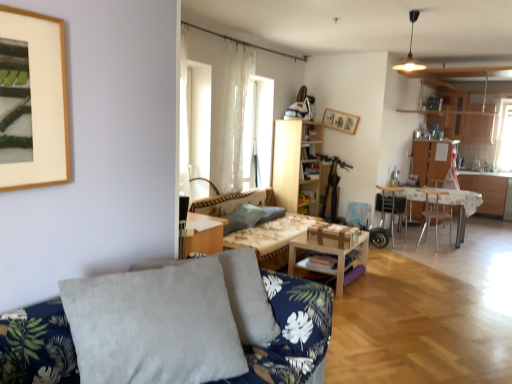
Question: From the image's perspective, is woodenobject at center beneath gray fabric pillow at center, the 2th pillow viewed from the front?

Choices:
 (A) yes
 (B) no

Answer: (A)

Question: Is the depth of woodenobject at center less than that of gray fabric pillow at center, acting as the 1th pillow starting from the back?

Choices:
 (A) yes
 (B) no

Answer: (A)

Question: Is woodenobject at center oriented towards gray fabric pillow at center, acting as the 1th pillow starting from the back?

Choices:
 (A) yes
 (B) no

Answer: (A)

Question: Is woodenobject at center touching gray fabric pillow at center, acting as the 1th pillow starting from the back?

Choices:
 (A) yes
 (B) no

Answer: (B)

Question: Can you confirm if woodenobject at center is shorter than gray fabric pillow at center, the 2th pillow viewed from the front?

Choices:
 (A) no
 (B) yes

Answer: (A)

Question: Can you confirm if woodenobject at center is bigger than gray fabric pillow at center, acting as the 1th pillow starting from the back?

Choices:
 (A) yes
 (B) no

Answer: (A)

Question: Is metallic silver chair at right, the 1th chair when ordered from left to right, taller than translucent fabric at center?

Choices:
 (A) yes
 (B) no

Answer: (B)

Question: Is translucent fabric at center a part of metallic silver chair at right, the 1th chair when ordered from left to right?

Choices:
 (A) yes
 (B) no

Answer: (B)

Question: Is metallic silver chair at right, which is counted as the second chair, starting from the right, far from translucent fabric at center?

Choices:
 (A) yes
 (B) no

Answer: (A)

Question: From the image's perspective, would you say metallic silver chair at right, the 1th chair when ordered from left to right, is positioned over translucent fabric at center?

Choices:
 (A) yes
 (B) no

Answer: (B)

Question: Can we say metallic silver chair at right, the 1th chair when ordered from left to right, lies outside translucent fabric at center?

Choices:
 (A) no
 (B) yes

Answer: (B)

Question: From the image's perspective, is metallic silver chair at right, the 1th chair when ordered from left to right, located beneath translucent fabric at center?

Choices:
 (A) no
 (B) yes

Answer: (B)

Question: From a real-world perspective, is woodenobject at center on top of metallic silver chair at right, which is counted as the second chair, starting from the right?

Choices:
 (A) yes
 (B) no

Answer: (B)